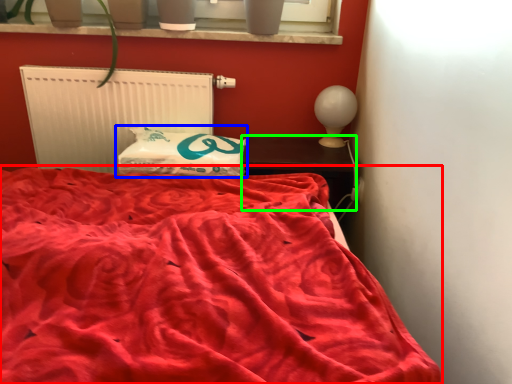
Question: Based on their relative distances, which object is farther from bed (highlighted by a red box)? Choose from pillow (highlighted by a blue box) and furniture (highlighted by a green box).

Choices:
 (A) pillow
 (B) furniture

Answer: (B)